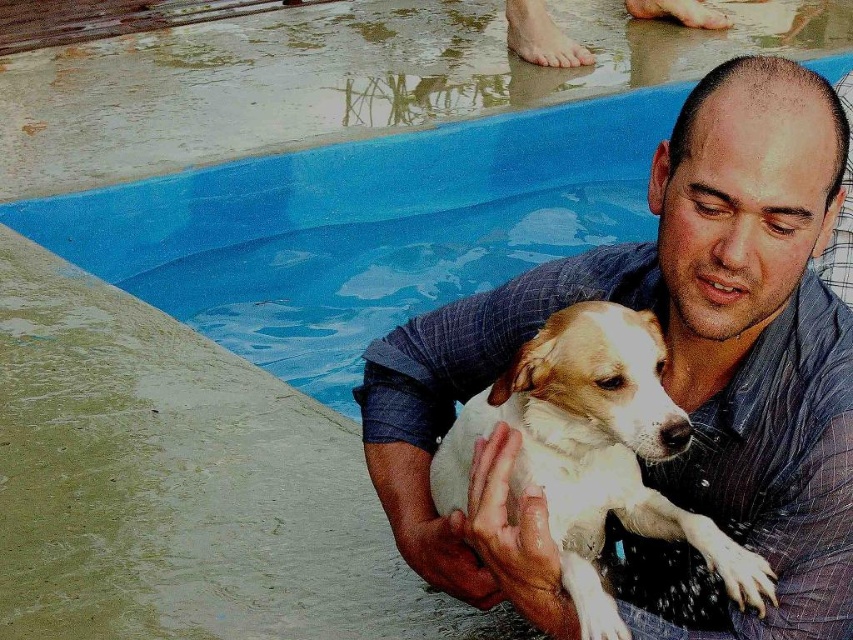
Question: Is blue plaid shirt at upper right closer to the viewer compared to blue plastic swimming pool at upper center?

Choices:
 (A) yes
 (B) no

Answer: (A)

Question: Is blue plastic swimming pool at upper center positioned behind white fur dog at center?

Choices:
 (A) no
 (B) yes

Answer: (B)

Question: Is blue plastic swimming pool at upper center in front of white fur dog at center?

Choices:
 (A) no
 (B) yes

Answer: (A)

Question: Which of these objects is positioned farthest from the blue plaid shirt at upper right?

Choices:
 (A) white fur dog at center
 (B) blue plastic swimming pool at upper center

Answer: (B)

Question: Based on their relative distances, which object is farther from the blue plastic swimming pool at upper center?

Choices:
 (A) blue plaid shirt at upper right
 (B) white fur dog at center

Answer: (B)

Question: Among these points, which one is farthest from the camera?

Choices:
 (A) (426, 211)
 (B) (520, 552)

Answer: (A)